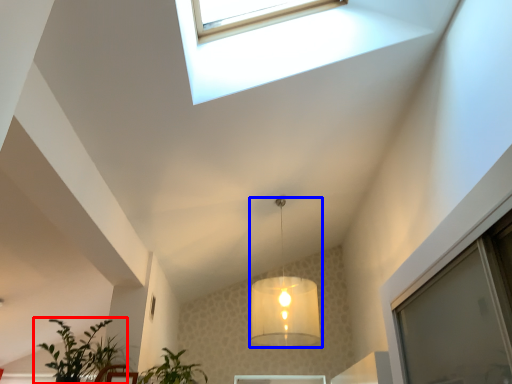
Question: Which point is closer to the camera, houseplant (highlighted by a red box) or lamp (highlighted by a blue box)?

Choices:
 (A) houseplant
 (B) lamp

Answer: (A)